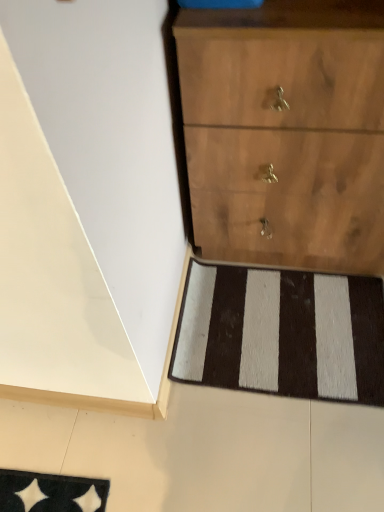
Image resolution: width=384 pixels, height=512 pixels. What do you see at coordinates (286, 132) in the screenshot? I see `wooden chest of drawers at center` at bounding box center [286, 132].

Find the location of a particular element. This screenshot has width=384, height=512. wooden chest of drawers at center is located at coordinates (286, 132).

Find the location of a particular element. This screenshot has width=384, height=512. black/white striped rug at lower center is located at coordinates (282, 333).

Looking at this image, measure the distance between black/white striped rug at lower center and camera.

black/white striped rug at lower center and camera are 3.59 feet apart from each other.

This screenshot has height=512, width=384. Describe the element at coordinates (282, 333) in the screenshot. I see `black/white striped rug at lower center` at that location.

In order to face black/white striped rug at lower center, should I rotate leftwards or rightwards?

Turn right by 11.816 degrees to look at black/white striped rug at lower center.

Where is `wooden chest of drawers at center`? wooden chest of drawers at center is located at coordinates (286, 132).

Looking at this image, considering the positions of objects black/white striped rug at lower center and wooden chest of drawers at center in the image provided, who is more to the right, black/white striped rug at lower center or wooden chest of drawers at center?

wooden chest of drawers at center.

Does black/white striped rug at lower center lie behind wooden chest of drawers at center?

Yes, black/white striped rug at lower center is further from the viewer.

Does point (380, 284) come in front of point (272, 122)?

That is False.

Looking at this image, from the image's perspective, is black/white striped rug at lower center over wooden chest of drawers at center?

No, from the image's perspective, black/white striped rug at lower center is not on top of wooden chest of drawers at center.

From a real-world perspective, is black/white striped rug at lower center positioned above or below wooden chest of drawers at center?

Clearly, from a real-world perspective, black/white striped rug at lower center is below wooden chest of drawers at center.

From the picture: Which of these two, black/white striped rug at lower center or wooden chest of drawers at center, is thinner?

wooden chest of drawers at center is thinner.

Between black/white striped rug at lower center and wooden chest of drawers at center, which one has less height?

With less height is black/white striped rug at lower center.

Considering the sizes of black/white striped rug at lower center and wooden chest of drawers at center in the image, is black/white striped rug at lower center bigger or smaller than wooden chest of drawers at center?

Clearly, black/white striped rug at lower center is smaller in size than wooden chest of drawers at center.

In the scene shown: Is black/white striped rug at lower center surrounding wooden chest of drawers at center?

That's incorrect, wooden chest of drawers at center is not inside black/white striped rug at lower center.

Is black/white striped rug at lower center beside wooden chest of drawers at center?

No, black/white striped rug at lower center is not next to wooden chest of drawers at center.

Is black/white striped rug at lower center looking in the opposite direction of wooden chest of drawers at center?

No, black/white striped rug at lower center's orientation is not away from wooden chest of drawers at center.

How different are the orientations of black/white striped rug at lower center and wooden chest of drawers at center in degrees?

There is a 0.000259-degree angle between the facing directions of black/white striped rug at lower center and wooden chest of drawers at center.

Measure the distance between black/white striped rug at lower center and wooden chest of drawers at center.

They are 15.30 inches apart.

This screenshot has width=384, height=512. Identify the location of the chest of drawers in front of the black/white striped rug at lower center. (286, 132).

Which object is positioned more to the right, wooden chest of drawers at center or black/white striped rug at lower center?

From the viewer's perspective, wooden chest of drawers at center appears more on the right side.

Is wooden chest of drawers at center behind black/white striped rug at lower center?

No, wooden chest of drawers at center is closer to the camera.

Is point (341, 214) closer or farther from the camera than point (320, 361)?

Point (341, 214) is closer to the camera than point (320, 361).

From the image's perspective, would you say wooden chest of drawers at center is positioned over black/white striped rug at lower center?

Correct, wooden chest of drawers at center appears higher than black/white striped rug at lower center in the image.

From a real-world perspective, relative to black/white striped rug at lower center, is wooden chest of drawers at center vertically above or below?

wooden chest of drawers at center is above black/white striped rug at lower center.

Which object is thinner, wooden chest of drawers at center or black/white striped rug at lower center?

wooden chest of drawers at center is thinner.

Who is shorter, wooden chest of drawers at center or black/white striped rug at lower center?

black/white striped rug at lower center.

Does wooden chest of drawers at center have a smaller size compared to black/white striped rug at lower center?

Incorrect, wooden chest of drawers at center is not smaller in size than black/white striped rug at lower center.

Is wooden chest of drawers at center completely or partially outside of black/white striped rug at lower center?

Yes, wooden chest of drawers at center is outside of black/white striped rug at lower center.

Is wooden chest of drawers at center far from black/white striped rug at lower center?

No.

Could you tell me if wooden chest of drawers at center is facing black/white striped rug at lower center?

Yes.

What's the angular difference between wooden chest of drawers at center and black/white striped rug at lower center's facing directions?

The facing directions of wooden chest of drawers at center and black/white striped rug at lower center are 0.000259 degrees apart.

Identify the location of doormat that appears behind the wooden chest of drawers at center. This screenshot has height=512, width=384. (282, 333).

Locate an element on the screen. The height and width of the screenshot is (512, 384). chest of drawers to the right of black/white striped rug at lower center is located at coordinates (286, 132).

I want to click on doormat beneath the wooden chest of drawers at center (from a real-world perspective), so click(282, 333).